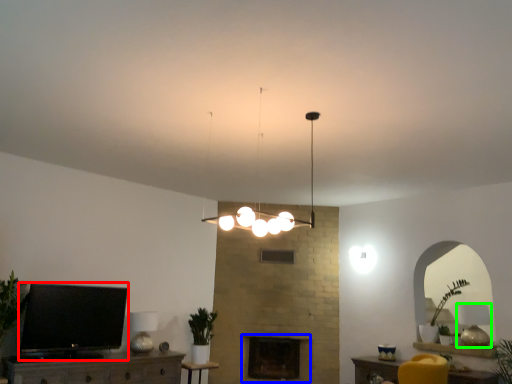
Question: Considering the real-world distances, which object is closest to television (highlighted by a red box)? fireplace (highlighted by a blue box) or lamp (highlighted by a green box).

Choices:
 (A) fireplace
 (B) lamp

Answer: (A)